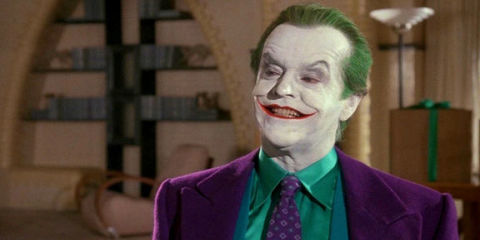
The width and height of the screenshot is (480, 240). Identify the location of box. (408, 143).